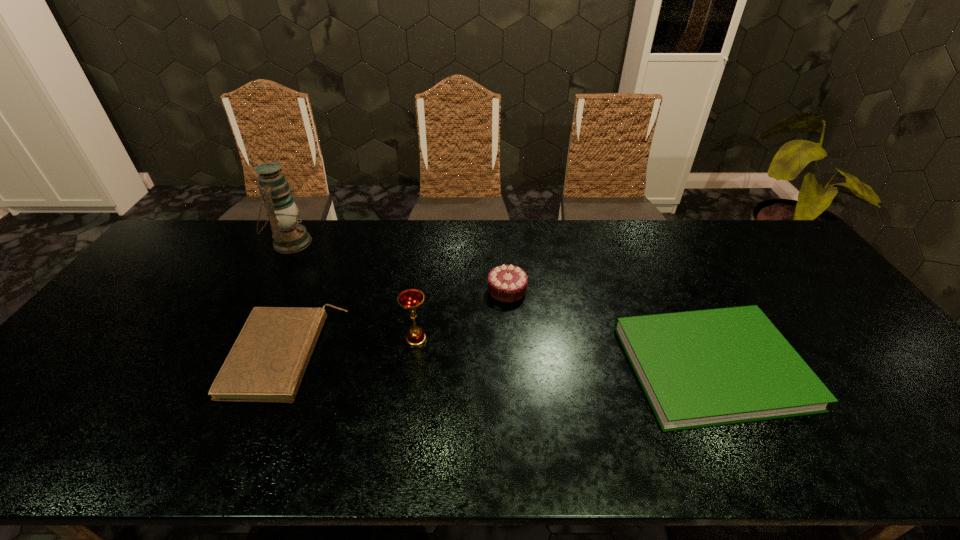
The width and height of the screenshot is (960, 540). Find the location of `the tallest object`. the tallest object is located at coordinates (288, 236).

In order to click on oil lamp in this screenshot , I will do `click(288, 236)`.

Where is `the fourth shortest object`? This screenshot has height=540, width=960. the fourth shortest object is located at coordinates (411, 299).

At what (x,y) coordinates should I click in order to perform the action: click on chalice. Please return your answer as a coordinate pair (x, y). Image resolution: width=960 pixels, height=540 pixels. Looking at the image, I should click on (411, 299).

Find the location of `the fourth nearest object`. the fourth nearest object is located at coordinates (506, 283).

Locate an element on the screen. The width and height of the screenshot is (960, 540). the second object from right to left is located at coordinates (506, 283).

You are a GUI agent. You are given a task and a screenshot of the screen. Output one action in this format:
    pyautogui.click(x=<x>, y=<y>)
    Task: Click on the left paperback book
    The height and width of the screenshot is (540, 960).
    Given the screenshot: What is the action you would take?
    pyautogui.click(x=267, y=362)

What are the coordinates of `the rightmost object` in the screenshot? It's located at (704, 368).

Find the location of `free region located 0.090m on the front of the farthest object`. free region located 0.090m on the front of the farthest object is located at coordinates (272, 278).

Identify the location of vacant space positioned on the front of the chalice. Image resolution: width=960 pixels, height=540 pixels. (412, 370).